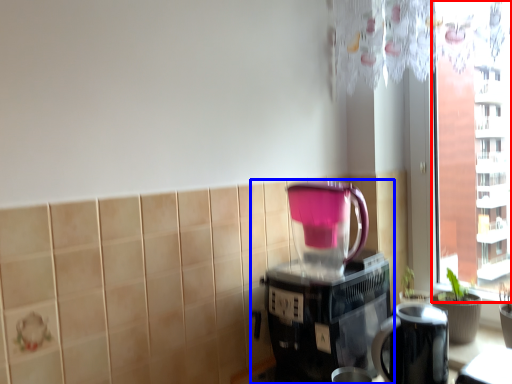
Question: Which object appears farthest to the camera in this image, window screen (highlighted by a red box) or coffee maker (highlighted by a blue box)?

Choices:
 (A) window screen
 (B) coffee maker

Answer: (A)